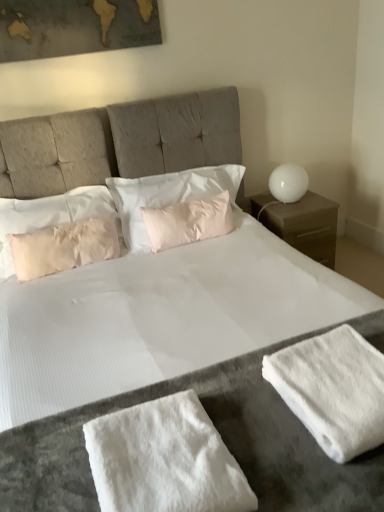
The height and width of the screenshot is (512, 384). What do you see at coordinates (164, 460) in the screenshot?
I see `white fluffy towel at lower center` at bounding box center [164, 460].

What do you see at coordinates (48, 215) in the screenshot? I see `pink fabric pillow at upper left, which is the first pillow in left-to-right order` at bounding box center [48, 215].

You are a GUI agent. You are given a task and a screenshot of the screen. Output one action in this format:
    pyautogui.click(x=<x>, y=<y>)
    Task: Click on the pink fabric pillow at upper left, placed as the third pillow when sorted from right to left
    The image size is (384, 512).
    Given the screenshot: What is the action you would take?
    pyautogui.click(x=48, y=215)

Describe the element at coordinates (333, 390) in the screenshot. I see `white fluffy bath towel at lower right` at that location.

Describe the element at coordinates (306, 226) in the screenshot. I see `white matte nightstand at right` at that location.

Identify the location of pink satin pillow at center, the second pillow viewed from the right. The height and width of the screenshot is (512, 384). 167,195.

The width and height of the screenshot is (384, 512). What do you see at coordinates (188, 221) in the screenshot?
I see `pink textured pillow at center, the first pillow when ordered from right to left` at bounding box center [188, 221].

This screenshot has height=512, width=384. What are the coordinates of `white fluffy towel at lower center` in the screenshot? It's located at (164, 460).

The width and height of the screenshot is (384, 512). Identify the location of the 1st pillow located beneath the pink fabric pillow at upper left, placed as the third pillow when sorted from right to left (from a real-world perspective). click(x=167, y=195).

Does pink fabric pillow at upper left, which is the first pillow in left-to-right order, have a greater width compared to pink satin pillow at center, the second pillow viewed from the right?

No.

Is point (47, 217) closer or farther from the camera than point (160, 191)?

Point (47, 217) is positioned closer to the camera compared to point (160, 191).

Is pink fabric pillow at upper left, which is the first pillow in left-to-right order, taller or shorter than pink satin pillow at center, the second pillow viewed from the right?

Considering their sizes, pink fabric pillow at upper left, which is the first pillow in left-to-right order, has more height than pink satin pillow at center, the second pillow viewed from the right.

Which is correct: white matte table lamp at right is inside pink fabric pillow at upper left, which is the first pillow in left-to-right order, or outside of it?

The correct answer is: outside.

In the scene shown: Considering the sizes of objects white matte table lamp at right and pink fabric pillow at upper left, placed as the third pillow when sorted from right to left, in the image provided, who is thinner, white matte table lamp at right or pink fabric pillow at upper left, placed as the third pillow when sorted from right to left,?

white matte table lamp at right is thinner.

Can you confirm if white matte table lamp at right is shorter than pink fabric pillow at upper left, which is the first pillow in left-to-right order?

Indeed, white matte table lamp at right has a lesser height compared to pink fabric pillow at upper left, which is the first pillow in left-to-right order.

Looking at the image, does white matte table lamp at right seem bigger or smaller compared to pink fabric pillow at upper left, placed as the third pillow when sorted from right to left?

Clearly, white matte table lamp at right is smaller in size than pink fabric pillow at upper left, placed as the third pillow when sorted from right to left.

Where is `the 1st pillow above when counting from the pink fabric pillow at upper left, which is the first pillow in left-to-right order (from the image's perspective)`? Image resolution: width=384 pixels, height=512 pixels. the 1st pillow above when counting from the pink fabric pillow at upper left, which is the first pillow in left-to-right order (from the image's perspective) is located at coordinates (188, 221).

Which object is wider, pink fabric pillow at upper left, which is the first pillow in left-to-right order, or pink textured pillow at center, the first pillow when ordered from right to left?

With larger width is pink fabric pillow at upper left, which is the first pillow in left-to-right order.

From the image's perspective, would you say pink fabric pillow at upper left, which is the first pillow in left-to-right order, is positioned over pink textured pillow at center, which is the 3th pillow from left to right?

No, from the image's perspective, pink fabric pillow at upper left, which is the first pillow in left-to-right order, is not on top of pink textured pillow at center, which is the 3th pillow from left to right.

Is pink fabric pillow at upper left, which is the first pillow in left-to-right order, at the left side of pink textured pillow at center, which is the 3th pillow from left to right?

Correct, you'll find pink fabric pillow at upper left, which is the first pillow in left-to-right order, to the left of pink textured pillow at center, which is the 3th pillow from left to right.

From a real-world perspective, which object stands above the other?

From a 3D spatial view, pink satin pillow at center, the second pillow viewed from the right, is above.

How much distance is there between pink satin pillow at center, the second pillow viewed from the right, and white fluffy towel at lower center?

The distance of pink satin pillow at center, the second pillow viewed from the right, from white fluffy towel at lower center is 4.69 feet.

Is point (186, 189) closer or farther from the camera than point (193, 397)?

Clearly, point (186, 189) is more distant from the camera than point (193, 397).

Is pink satin pillow at center, the second pillow viewed from the right, not close to white fluffy towel at lower center?

Yes, pink satin pillow at center, the second pillow viewed from the right, and white fluffy towel at lower center are located far from each other.

This screenshot has height=512, width=384. In order to click on material directly beneath the white matte table lamp at right (from a real-world perspective) in this screenshot , I will do `click(164, 460)`.

From the image's perspective, is white fluffy towel at lower center above white matte table lamp at right?

Incorrect, from the image's perspective, white fluffy towel at lower center is lower than white matte table lamp at right.

In the image, is white fluffy towel at lower center positioned in front of or behind white matte table lamp at right?

Clearly, white fluffy towel at lower center is in front of white matte table lamp at right.

Does white fluffy towel at lower center contain white matte table lamp at right?

No, white matte table lamp at right is not inside white fluffy towel at lower center.

Which is more to the right, white fluffy bath towel at lower right or white fluffy towel at lower center?

white fluffy bath towel at lower right.

Which is correct: white fluffy bath towel at lower right is inside white fluffy towel at lower center, or outside of it?

The correct answer is: outside.

Is the position of white fluffy bath towel at lower right more distant than that of white fluffy towel at lower center?

Yes, white fluffy bath towel at lower right is behind white fluffy towel at lower center.

Is white fluffy bath towel at lower right positioned with its back to white fluffy towel at lower center?

white fluffy bath towel at lower right is not turned away from white fluffy towel at lower center.

Which of these two, white fluffy bath towel at lower right or white matte nightstand at right, stands shorter?

Standing shorter between the two is white fluffy bath towel at lower right.

Does white fluffy bath towel at lower right appear on the right side of white matte nightstand at right?

In fact, white fluffy bath towel at lower right is to the left of white matte nightstand at right.

Is white fluffy bath towel at lower right located outside white matte nightstand at right?

Absolutely, white fluffy bath towel at lower right is external to white matte nightstand at right.

What are the coordinates of `bath towel above the white matte nightstand at right (from a real-world perspective)` in the screenshot? It's located at (333, 390).

Locate an element on the screen. the 1st pillow behind the pink fabric pillow at upper left, which is the first pillow in left-to-right order is located at coordinates (167, 195).

Locate an element on the screen. The image size is (384, 512). table lamp above the pink fabric pillow at upper left, which is the first pillow in left-to-right order (from the image's perspective) is located at coordinates (288, 183).

Estimate the real-world distances between objects in this image. Which object is closer to white fluffy bath towel at lower right, white matte table lamp at right or pink fabric pillow at upper left, which is the first pillow in left-to-right order?

Based on the image, pink fabric pillow at upper left, which is the first pillow in left-to-right order, appears to be nearer to white fluffy bath towel at lower right.

Based on their spatial positions, is white fluffy bath towel at lower right or pink textured pillow at center, which is the 3th pillow from left to right, closer to white matte nightstand at right?

Among the two, pink textured pillow at center, which is the 3th pillow from left to right, is located nearer to white matte nightstand at right.

Looking at the image, which one is located further to white fluffy bath towel at lower right, white fluffy towel at lower center or pink fabric pillow at upper left, placed as the third pillow when sorted from right to left?

pink fabric pillow at upper left, placed as the third pillow when sorted from right to left, is positioned further to the anchor white fluffy bath towel at lower right.

Which object lies nearer to the anchor point white matte nightstand at right, pink textured pillow at center, which is the 3th pillow from left to right, or pink satin pillow at center, which is the 2th pillow from left to right?

pink textured pillow at center, which is the 3th pillow from left to right, is closer to white matte nightstand at right.

Looking at this image, looking at the image, which one is located further to white fluffy towel at lower center, pink textured pillow at center, the first pillow when ordered from right to left, or white matte nightstand at right?

Based on the image, white matte nightstand at right appears to be further to white fluffy towel at lower center.

Looking at the image, which one is located further to white matte table lamp at right, white fluffy towel at lower center or white fluffy bath towel at lower right?

Based on the image, white fluffy towel at lower center appears to be further to white matte table lamp at right.

When comparing their distances from white fluffy bath towel at lower right, does pink textured pillow at center, the first pillow when ordered from right to left, or white fluffy towel at lower center seem closer?

white fluffy towel at lower center is positioned closer to the anchor white fluffy bath towel at lower right.

From the image, which object appears to be farther from pink fabric pillow at upper left, which is the first pillow in left-to-right order, white fluffy towel at lower center or white fluffy bath towel at lower right?

white fluffy bath towel at lower right is positioned further to the anchor pink fabric pillow at upper left, which is the first pillow in left-to-right order.

Where is `pillow between pink fabric pillow at upper left, placed as the third pillow when sorted from right to left, and pink textured pillow at center, the first pillow when ordered from right to left, in the horizontal direction`? This screenshot has width=384, height=512. pillow between pink fabric pillow at upper left, placed as the third pillow when sorted from right to left, and pink textured pillow at center, the first pillow when ordered from right to left, in the horizontal direction is located at coordinates (167, 195).

You are a GUI agent. You are given a task and a screenshot of the screen. Output one action in this format:
    pyautogui.click(x=<x>, y=<y>)
    Task: Click on the bath towel located between white fluffy towel at lower center and white matte table lamp at right in the depth direction
    The width and height of the screenshot is (384, 512).
    Given the screenshot: What is the action you would take?
    pyautogui.click(x=333, y=390)

Locate an element on the screen. This screenshot has height=512, width=384. bath towel located between white fluffy towel at lower center and white matte nightstand at right in the depth direction is located at coordinates (333, 390).

In order to click on pillow between white fluffy towel at lower center and pink satin pillow at center, the second pillow viewed from the right, in the front-back direction in this screenshot , I will do `click(48, 215)`.